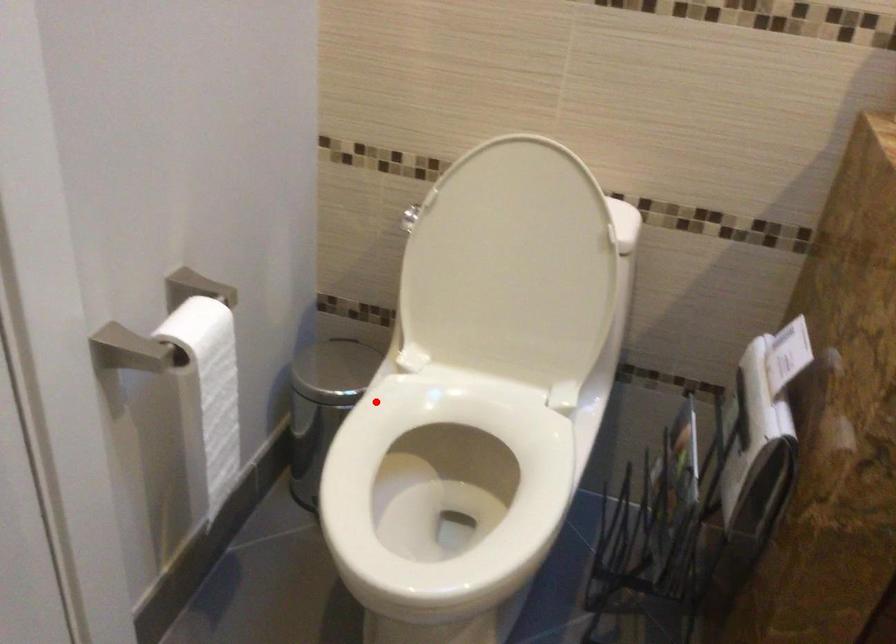
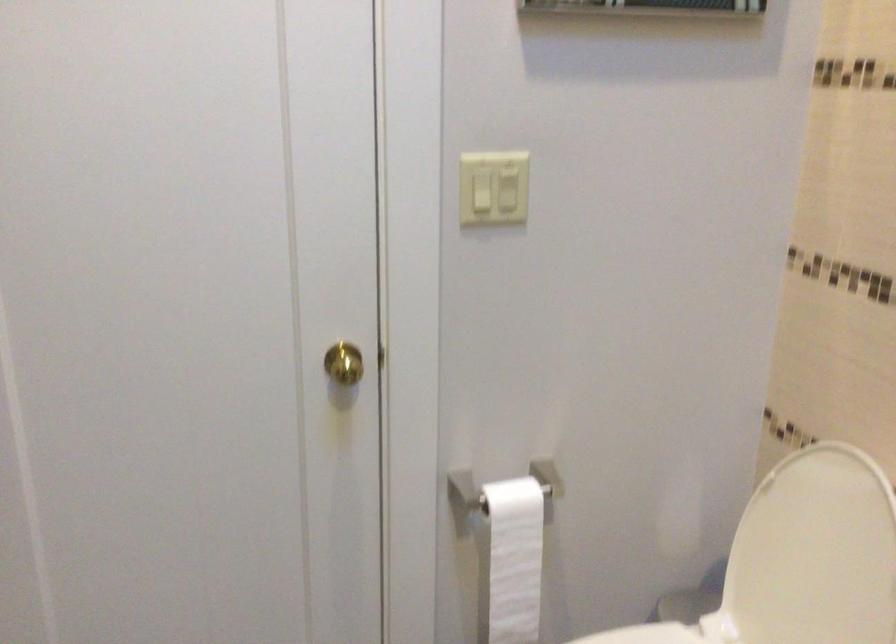
Question: I am providing you with two images of the same scene from different viewpoints. Image1 has a red point marked. In image2, the corresponding 3D location appears at what relative position? Reply with the corresponding letter.

Choices:
 (A) Closer
 (B) Farther

Answer: (B)